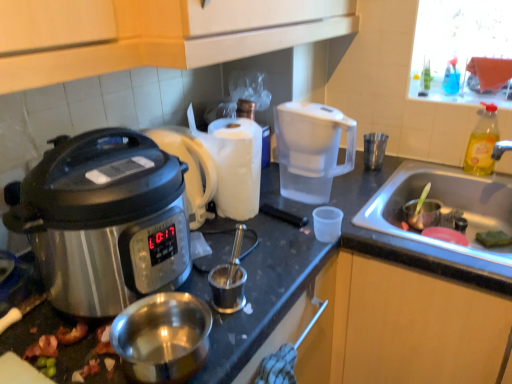
Question: Could you tell me if transparent plastic cup at center, the 1th coffee cup when ordered from left to right, is turned towards stainless steel slow cooker at left?

Choices:
 (A) yes
 (B) no

Answer: (B)

Question: Is transparent plastic cup at center, the 1th coffee cup viewed from the front, completely or partially outside of stainless steel slow cooker at left?

Choices:
 (A) yes
 (B) no

Answer: (A)

Question: Is transparent plastic cup at center, the 1th coffee cup when ordered from left to right, smaller than stainless steel slow cooker at left?

Choices:
 (A) no
 (B) yes

Answer: (B)

Question: Can you confirm if transparent plastic cup at center, which is counted as the 3th coffee cup, starting from the top, is positioned to the right of stainless steel slow cooker at left?

Choices:
 (A) yes
 (B) no

Answer: (A)

Question: Is transparent plastic cup at center, which is the 3th coffee cup in back-to-front order, placed right next to stainless steel slow cooker at left?

Choices:
 (A) yes
 (B) no

Answer: (B)

Question: From the image's perspective, is transparent plastic cup at center, the 1th coffee cup viewed from the front, on stainless steel slow cooker at left?

Choices:
 (A) yes
 (B) no

Answer: (B)

Question: From the image's perspective, is shiny metallic bacon at lower left below shiny silver pot at lower left?

Choices:
 (A) no
 (B) yes

Answer: (B)

Question: From the image's perspective, is shiny metallic bacon at lower left on shiny silver pot at lower left?

Choices:
 (A) yes
 (B) no

Answer: (B)

Question: Is shiny metallic bacon at lower left oriented away from shiny silver pot at lower left?

Choices:
 (A) yes
 (B) no

Answer: (B)

Question: From a real-world perspective, is shiny metallic bacon at lower left beneath shiny silver pot at lower left?

Choices:
 (A) no
 (B) yes

Answer: (B)

Question: Does shiny metallic bacon at lower left have a greater width compared to shiny silver pot at lower left?

Choices:
 (A) no
 (B) yes

Answer: (A)

Question: Is shiny metallic bacon at lower left closer to the viewer compared to shiny silver pot at lower left?

Choices:
 (A) no
 (B) yes

Answer: (A)

Question: Is transparent plastic water filter pitcher at center-right turned away from stainless steel sink at lower right?

Choices:
 (A) yes
 (B) no

Answer: (B)